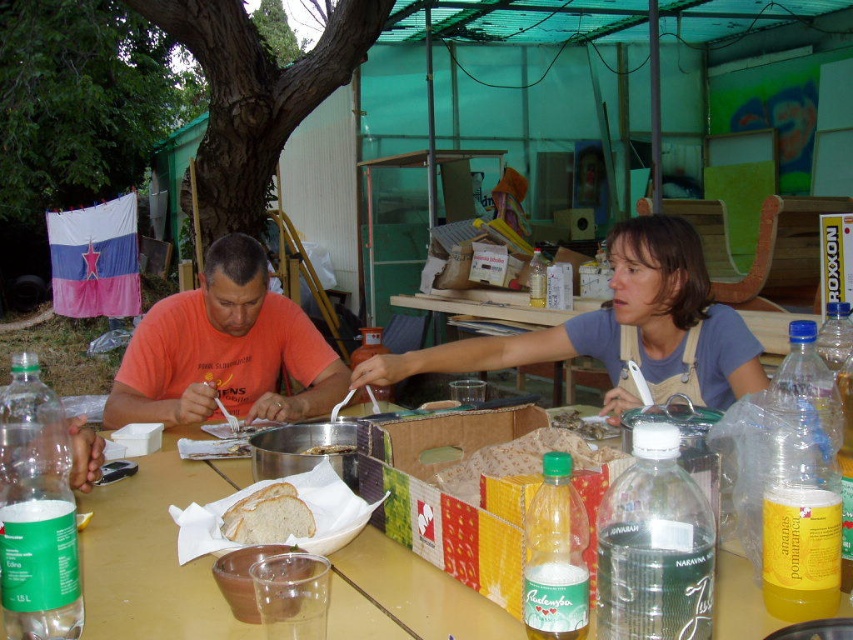
You are a photographer trying to capture a candid shot of the orange cotton shirt at left and the white bread at table center. Which object should you focus on first to ensure both are in frame without moving the camera?

The orange cotton shirt at left is taller than the white bread at table center, so focusing on the orange cotton shirt at left first would ensure both are in frame as it occupies more vertical space.

Consider the image. You are standing at the edge of the table in the image. There is a point marked at coordinates (224, 349) on the table. What object is located at this point?

The point at coordinates (224, 349) marks the orange cotton shirt at left.

You are a guest at this table and want to grab the white soft bread at center. However, you notice another piece of white bread at table center nearby. Which one is positioned lower on the table?

The white soft bread at center is located below the white bread at table center, so it is positioned lower on the table.